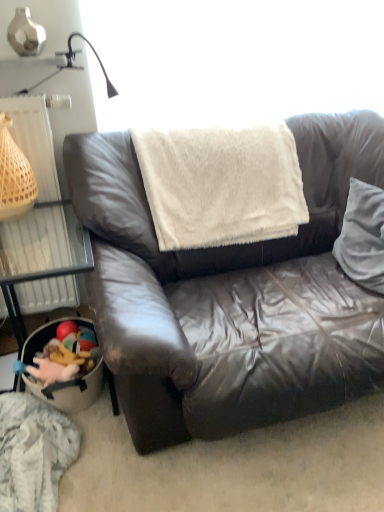
What is the approximate height of white soft pillow at right?

The height of white soft pillow at right is 32.16 centimeters.

This screenshot has height=512, width=384. Describe the element at coordinates (55, 376) in the screenshot. I see `plush toy at lower left` at that location.

The image size is (384, 512). Describe the element at coordinates (44, 269) in the screenshot. I see `wooden toy basket at lower left` at that location.

At what (x,y) coordinates should I click in order to perform the action: click on wooden toy basket at lower left. Please return your answer as a coordinate pair (x, y). Looking at the image, I should click on (44, 269).

This screenshot has height=512, width=384. I want to click on white fluffy blanket at center, so click(220, 183).

Describe the element at coordinates (14, 176) in the screenshot. Image resolution: width=384 pixels, height=512 pixels. I see `beige woven basket at left` at that location.

Find the location of a particular element. The width and height of the screenshot is (384, 512). leather couch at center is located at coordinates (229, 296).

The image size is (384, 512). Find the location of `studio couch lying above the plush toy at lower left (from the image's perspective)`. studio couch lying above the plush toy at lower left (from the image's perspective) is located at coordinates (229, 296).

Is there a large distance between plush toy at lower left and leather couch at center?

They are positioned close to each other.

From a real-world perspective, is plush toy at lower left physically below leather couch at center?

Yes, from a real-world perspective, plush toy at lower left is under leather couch at center.

Is plush toy at lower left positioned with its back to white fluffy blanket at center?

plush toy at lower left does not have its back to white fluffy blanket at center.

Would you say white fluffy blanket at center is part of plush toy at lower left's contents?

No, white fluffy blanket at center is not a part of plush toy at lower left.

Is plush toy at lower left taller or shorter than white fluffy blanket at center?

plush toy at lower left is shorter than white fluffy blanket at center.

Considering the relative sizes of plush toy at lower left and white fluffy blanket at center in the image provided, is plush toy at lower left thinner than white fluffy blanket at center?

Yes.

Considering the sizes of objects leather couch at center and white fluffy blanket at center in the image provided, who is shorter, leather couch at center or white fluffy blanket at center?

white fluffy blanket at center is shorter.

Would you consider leather couch at center to be distant from white fluffy blanket at center?

No.

Who is bigger, leather couch at center or white fluffy blanket at center?

Bigger between the two is leather couch at center.

In the scene shown: From a real-world perspective, is leather couch at center positioned above or below white fluffy blanket at center?

In terms of real-world spatial position, leather couch at center is below white fluffy blanket at center.

From the image's perspective, is white fluffy blanket at center positioned above or below beige woven basket at left?

From the image's perspective, white fluffy blanket at center appears below beige woven basket at left.

Which of these two, white fluffy blanket at center or beige woven basket at left, is thinner?

With smaller width is beige woven basket at left.

Which of these two, white fluffy blanket at center or beige woven basket at left, is bigger?

Bigger between the two is white fluffy blanket at center.

From the picture: Is white fluffy blanket at center oriented away from beige woven basket at left?

white fluffy blanket at center is not turned away from beige woven basket at left.

From the image's perspective, which one is positioned lower, white soft pillow at right or fluffy gray blanket at lower left?

fluffy gray blanket at lower left.

Based on the photo, in the image, is white soft pillow at right on the left side or the right side of fluffy gray blanket at lower left?

white soft pillow at right is to the right of fluffy gray blanket at lower left.

Is white soft pillow at right turned away from fluffy gray blanket at lower left?

No, white soft pillow at right is not facing the opposite direction of fluffy gray blanket at lower left.

Between white soft pillow at right and fluffy gray blanket at lower left, which one has smaller width?

fluffy gray blanket at lower left.

From a real-world perspective, who is located lower, white plastic radiator at left or beige woven basket at left?

white plastic radiator at left is physically lower.

Identify the location of radiator on the left of the beige woven basket at left. (36, 242).

Could you tell me if white plastic radiator at left is turned towards beige woven basket at left?

Yes, white plastic radiator at left faces towards beige woven basket at left.

Which is more to the left, white plastic radiator at left or beige woven basket at left?

From the viewer's perspective, white plastic radiator at left appears more on the left side.

Is white soft pillow at right far away from leather couch at center?

They are positioned close to each other.

What's the angular difference between white soft pillow at right and leather couch at center's facing directions?

The angular difference between white soft pillow at right and leather couch at center is 94.2 degrees.

Considering the positions of objects white soft pillow at right and leather couch at center in the image provided, who is more to the right, white soft pillow at right or leather couch at center?

From the viewer's perspective, white soft pillow at right appears more on the right side.

Is point (362, 233) closer to viewer compared to point (301, 306)?

No, (362, 233) is behind (301, 306).

Where is `studio couch above the plush toy at lower left (from the image's perspective)`? This screenshot has width=384, height=512. studio couch above the plush toy at lower left (from the image's perspective) is located at coordinates (229, 296).

I want to click on stuff below the white fluffy blanket at center (from a real-world perspective), so click(x=55, y=376).

When comparing their distances from white plastic radiator at left, does beige woven basket at left or white fluffy blanket at center seem further?

white fluffy blanket at center is positioned further to the anchor white plastic radiator at left.

From the picture: From the image, which object appears to be nearer to white fluffy blanket at center, wooden toy basket at lower left or fluffy gray blanket at lower left?

wooden toy basket at lower left.

Considering their positions, is white plastic radiator at left positioned closer to plush toy at lower left than white soft pillow at right?

white plastic radiator at left is positioned closer to the anchor plush toy at lower left.

From the image, which object appears to be nearer to white plastic radiator at left, wooden toy basket at lower left or leather couch at center?

wooden toy basket at lower left is positioned closer to the anchor white plastic radiator at left.

Looking at this image, when comparing their distances from white plastic radiator at left, does wooden toy basket at lower left or plush toy at lower left seem further?

Based on the image, plush toy at lower left appears to be further to white plastic radiator at left.

Estimate the real-world distances between objects in this image. Which object is closer to plush toy at lower left, beige woven basket at left or wooden toy basket at lower left?

wooden toy basket at lower left lies closer to plush toy at lower left than the other object.

Which object lies nearer to the anchor point plush toy at lower left, white soft pillow at right or white fluffy blanket at center?

white fluffy blanket at center lies closer to plush toy at lower left than the other object.

Considering their positions, is white fluffy blanket at center positioned closer to white soft pillow at right than wooden toy basket at lower left?

white fluffy blanket at center is positioned closer to the anchor white soft pillow at right.

Where is `stuff between wooden toy basket at lower left and fluffy gray blanket at lower left vertically`? The height and width of the screenshot is (512, 384). stuff between wooden toy basket at lower left and fluffy gray blanket at lower left vertically is located at coordinates (55, 376).

Where is `basket between white plastic radiator at left and white fluffy blanket at center from left to right`? This screenshot has height=512, width=384. basket between white plastic radiator at left and white fluffy blanket at center from left to right is located at coordinates [14, 176].

Locate an element on the screen. This screenshot has height=512, width=384. radiator between beige woven basket at left and fluffy gray blanket at lower left from top to bottom is located at coordinates (36, 242).

Where is `stuff between white plastic radiator at left and fluffy gray blanket at lower left from top to bottom`? stuff between white plastic radiator at left and fluffy gray blanket at lower left from top to bottom is located at coordinates (55, 376).